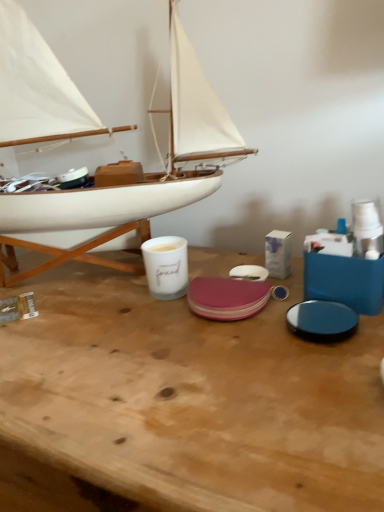
Locate an element on the screen. Image resolution: width=384 pixels, height=512 pixels. unoccupied area in front of white wood boat at left is located at coordinates (144, 379).